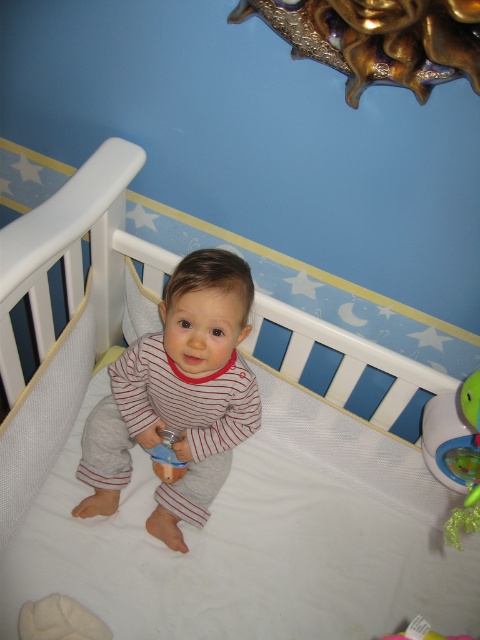
Does striped cotton baby at center have a greater height compared to blue rubber toy at center?

Yes.

Can you confirm if striped cotton baby at center is positioned above blue rubber toy at center?

Indeed, striped cotton baby at center is positioned over blue rubber toy at center.

Identify the location of striped cotton baby at center. The width and height of the screenshot is (480, 640). (179, 396).